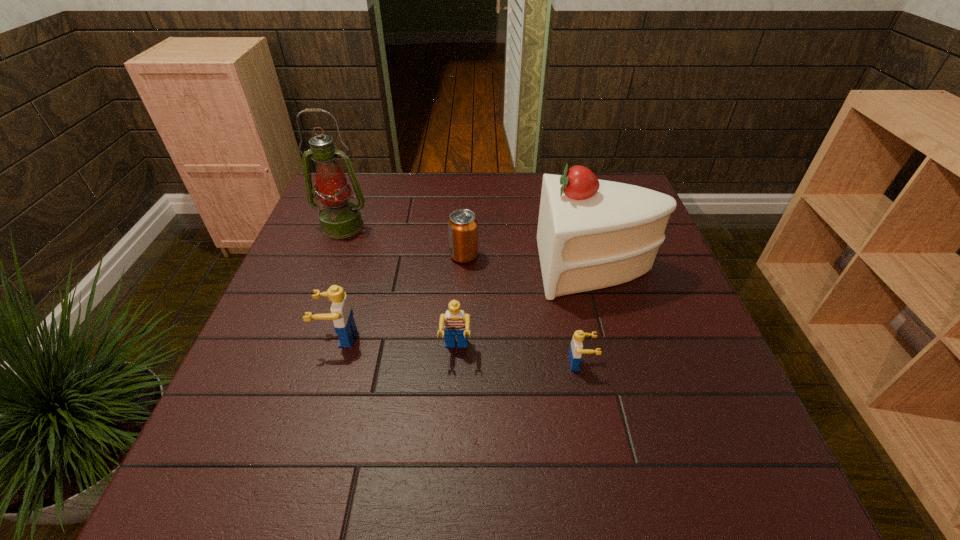
The width and height of the screenshot is (960, 540). I want to click on vacant space that's between the soda can and the shortest Lego, so click(522, 309).

Locate an element on the screen. The height and width of the screenshot is (540, 960). free space between the third tallest object and the cake is located at coordinates (468, 302).

You are a GUI agent. You are given a task and a screenshot of the screen. Output one action in this format:
    pyautogui.click(x=<x>, y=<y>)
    Task: Click on the free point between the soda can and the tallest object
    This screenshot has width=960, height=540.
    Given the screenshot: What is the action you would take?
    pyautogui.click(x=403, y=241)

This screenshot has width=960, height=540. In order to click on vacant area between the second tallest object and the soda can in this screenshot , I will do `click(531, 261)`.

You are a GUI agent. You are given a task and a screenshot of the screen. Output one action in this format:
    pyautogui.click(x=<x>, y=<y>)
    Task: Click on the fourth closest object relative to the second tallest Lego
    
    Given the screenshot: What is the action you would take?
    pyautogui.click(x=462, y=226)

You are a GUI agent. You are given a task and a screenshot of the screen. Output one action in this format:
    pyautogui.click(x=<x>, y=<y>)
    Task: Click on the object identified as the fourth closest to the leftmost Lego
    The image size is (960, 540).
    Given the screenshot: What is the action you would take?
    (592, 234)

Select which Lego appears as the second closest to the leftmost Lego. Please provide its 2D coordinates. Your answer should be formatted as a tuple, i.e. [(x, y)], where the tuple contains the x and y coordinates of a point satisfying the conditions above.

[(576, 350)]

At what (x,y) coordinates should I click in order to perform the action: click on Lego identified as the closest to the rightmost Lego. Please return your answer as a coordinate pair (x, y). Image resolution: width=960 pixels, height=540 pixels. Looking at the image, I should click on (454, 322).